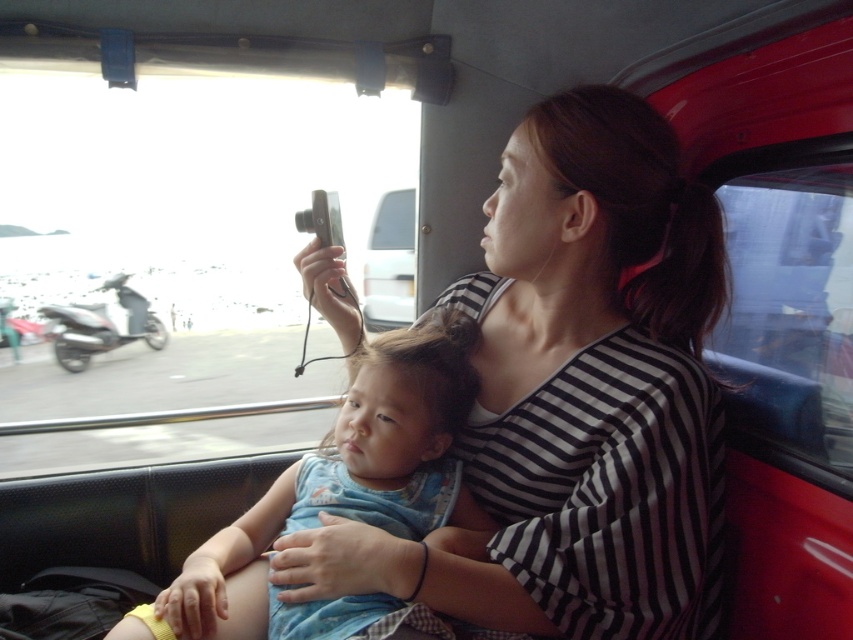
Question: Which point appears farthest from the camera in this image?

Choices:
 (A) (473, 604)
 (B) (367, 378)

Answer: (B)

Question: Does striped fabric shirt at center have a smaller size compared to blue denim dress at center?

Choices:
 (A) no
 (B) yes

Answer: (A)

Question: Which point is closer to the camera?

Choices:
 (A) (399, 465)
 (B) (345, 323)

Answer: (A)

Question: Is striped fabric shirt at center positioned before blue denim dress at center?

Choices:
 (A) yes
 (B) no

Answer: (B)

Question: Can you confirm if striped fabric shirt at center is smaller than blue denim dress at center?

Choices:
 (A) no
 (B) yes

Answer: (A)